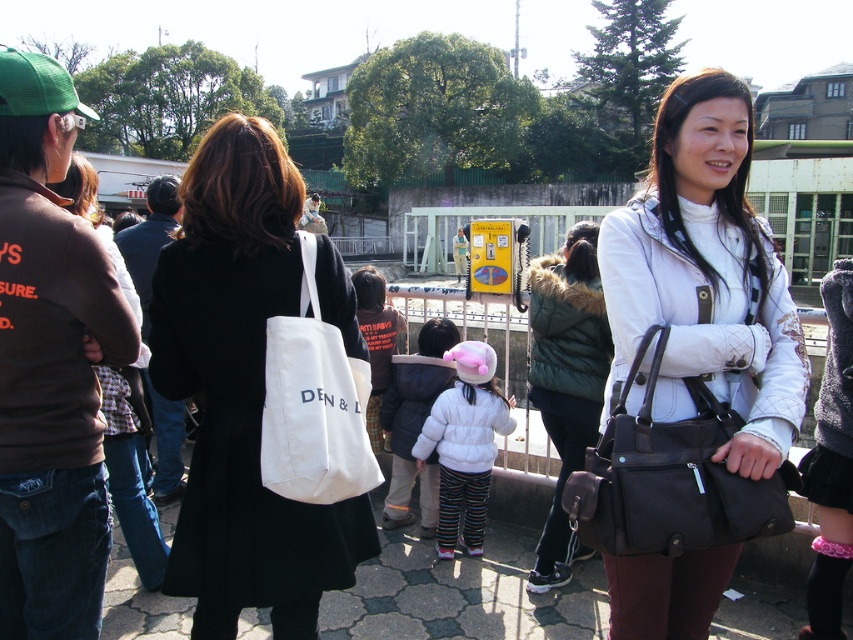
What is located at the coordinates point (241, 392)?

The white canvas bag at center is located at point (241, 392).

You are organizing a picnic and have a white canvas tote at center and a pink plush baseball hat at center. Which item can hold more items if you need to pack snacks and drinks?

The white canvas tote at center has a larger size compared to the pink plush baseball hat at center, so it can hold more items.